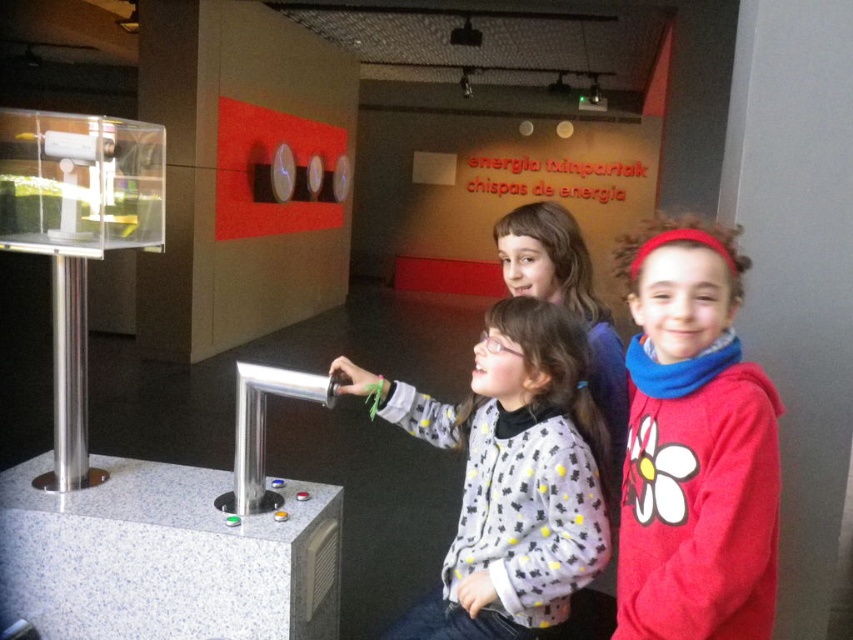
You are a museum visitor observing two children dressed in different clothing items. The red fleece jacket at center right and the white matte sweater at center are both on display. Which clothing item is narrower in width?

The red fleece jacket at center right is thinner than the white matte sweater at center, so the red fleece jacket at center right is narrower in width.

Based on the coordinates provided in the description, where is the red fleece jacket at center right located in the image?

The red fleece jacket at center right is located at coordinates point (694, 445).